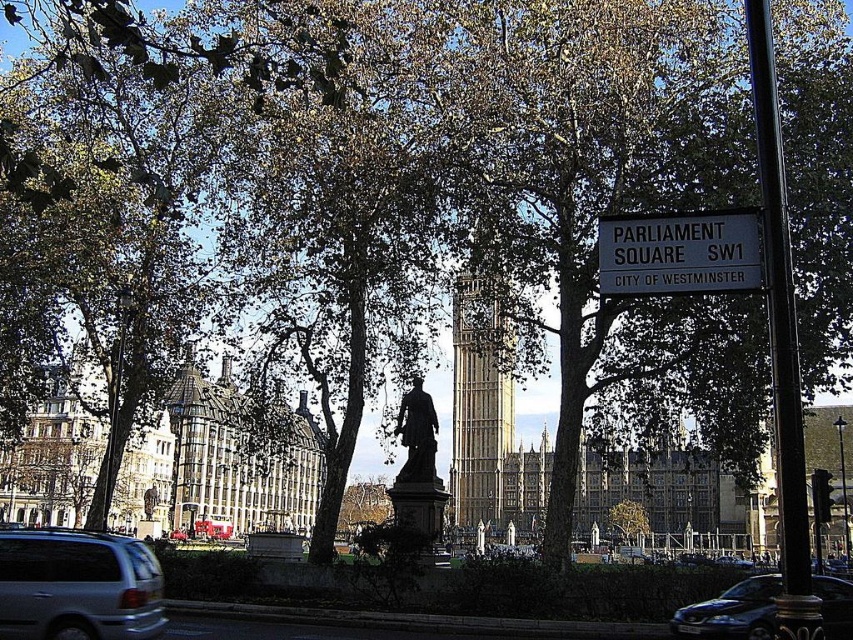
Where is `brown stone building at center`? The image size is (853, 640). brown stone building at center is located at coordinates (219, 464).

Does point (281, 442) come closer to viewer compared to point (732, 253)?

No, it is not.

Between point (224, 445) and point (599, 253), which one is positioned behind?

The point (224, 445) is more distant.

Where is `brown stone building at center`? This screenshot has width=853, height=640. brown stone building at center is located at coordinates (219, 464).

Who is more forward, (190, 358) or (112, 582)?

Point (112, 582) is more forward.

Between point (296, 436) and point (160, 602), which one is positioned behind?

The point (296, 436) is more distant.

Identify the location of brown stone building at center. Image resolution: width=853 pixels, height=640 pixels. (219, 464).

Who is more distant from viewer, (460, 406) or (845, 625)?

The point (460, 406) is behind.

Is golden stone clock tower at center bigger than shiny black car at lower right?

Indeed, golden stone clock tower at center has a larger size compared to shiny black car at lower right.

Locate an element on the screen. golden stone clock tower at center is located at coordinates (480, 397).